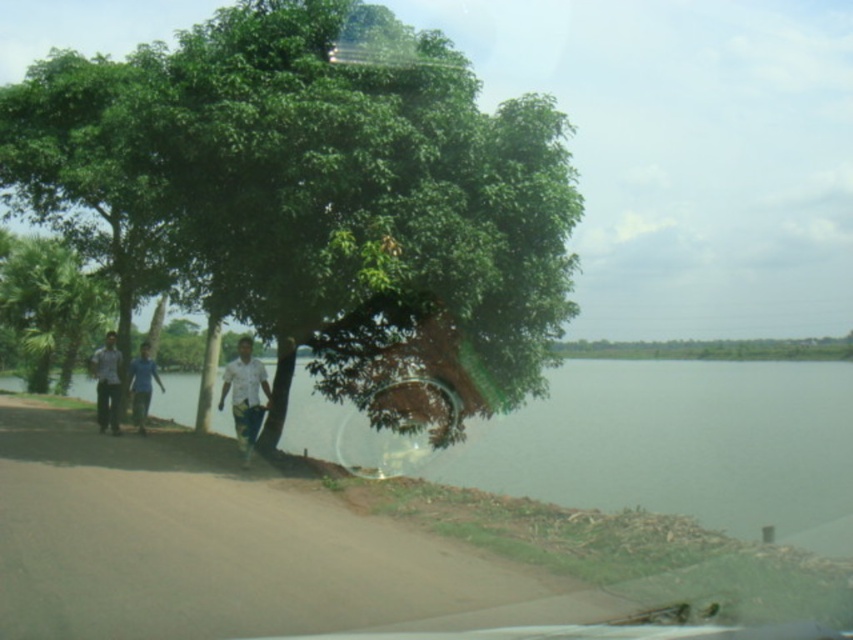
You are a hiker who wants to take a photo of the light blue shirt at left and the green leafy tree at center. Since the tree is wider than the shirt, how should you position your camera to include both in the frame?

The green leafy tree at center is wider than the light blue shirt at left, so you should position your camera to capture the full width of the tree while ensuring the light blue shirt at left is also visible within the frame.

You are a hiker standing on the dirt path and want to take a photo of the blue cotton shirt at center without the green leafy tree at center blocking it. How can you adjust your position to achieve this?

Since the green leafy tree at center is larger in size than the blue cotton shirt at center, you should move to the side of the path away from the tree to ensure the tree doesn not block the view of the blue cotton shirt at center.

Looking at this image, you are a photographer standing on the dirt path and want to take a photo of the white shirt at center and the blue cotton shirt at center. Which person should you focus on first if you want to capture both in the same frame without moving the camera?

You should focus on the white shirt at center first because it is taller than the blue cotton shirt at center, ensuring it fits within the frame when positioned properly.